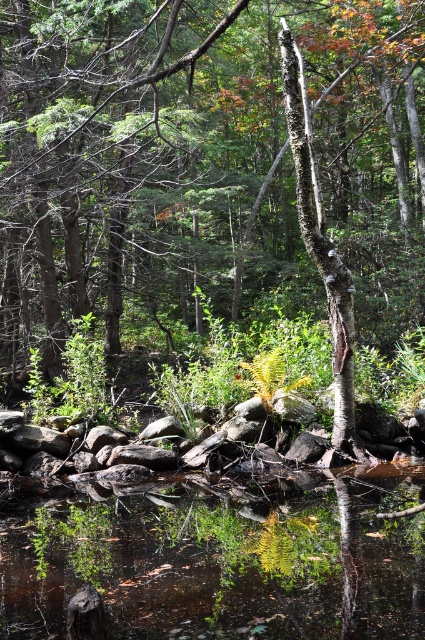
You are a photographer trying to capture the smooth bark tree at center and the clear water at center in a single shot. Which object will appear closer to the camera in your photo?

The smooth bark tree at center will appear closer to the camera because it is further to the viewer than the clear water at center, meaning it is positioned nearer in the scene.

You are a photographer wanting to capture the reflection of the smooth bark tree at center in the clear water at center. Based on the scene, can you determine if the tree is positioned in a way that its reflection would be visible in the water?

The smooth bark tree at center is located above clear water at center, so its reflection should be visible in the water since the tree is positioned directly above the water surface.

You are standing in the forest and see the smooth bark tree at center and the clear water at center. Which object is positioned to the left of the other?

The smooth bark tree at center is to the left of clear water at center.